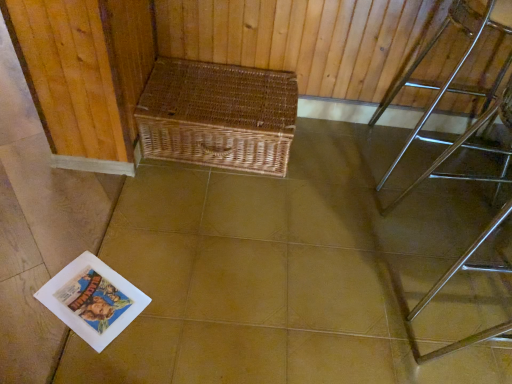
Question: Would you say woven brown picnic basket at center is outside polished chrome table at right?

Choices:
 (A) no
 (B) yes

Answer: (B)

Question: Are woven brown picnic basket at center and polished chrome table at right making contact?

Choices:
 (A) yes
 (B) no

Answer: (B)

Question: Is woven brown picnic basket at center shorter than polished chrome table at right?

Choices:
 (A) yes
 (B) no

Answer: (A)

Question: Is woven brown picnic basket at center further to the viewer compared to polished chrome table at right?

Choices:
 (A) yes
 (B) no

Answer: (A)

Question: Does woven brown picnic basket at center have a larger size compared to polished chrome table at right?

Choices:
 (A) no
 (B) yes

Answer: (A)

Question: From the image's perspective, is woven wicker basket at upper center above or below woven brown picnic basket at center?

Choices:
 (A) above
 (B) below

Answer: (B)

Question: Choose the correct answer: Is woven wicker basket at upper center inside woven brown picnic basket at center or outside it?

Choices:
 (A) inside
 (B) outside

Answer: (B)

Question: Does point (352, 307) appear closer or farther from the camera than point (224, 142)?

Choices:
 (A) farther
 (B) closer

Answer: (B)

Question: In terms of width, does woven wicker basket at upper center look wider or thinner when compared to woven brown picnic basket at center?

Choices:
 (A) wide
 (B) thin

Answer: (A)

Question: Considering their positions, is polished chrome table at right located in front of or behind woven wicker basket at upper center?

Choices:
 (A) front
 (B) behind

Answer: (A)

Question: From the image's perspective, is polished chrome table at right positioned above or below woven wicker basket at upper center?

Choices:
 (A) below
 (B) above

Answer: (B)

Question: Is point (488, 11) positioned closer to the camera than point (210, 344)?

Choices:
 (A) farther
 (B) closer

Answer: (A)

Question: Is polished chrome table at right bigger or smaller than woven wicker basket at upper center?

Choices:
 (A) small
 (B) big

Answer: (B)

Question: Is woven brown picnic basket at center inside or outside of polished chrome table at right?

Choices:
 (A) outside
 (B) inside

Answer: (A)

Question: In terms of width, does woven brown picnic basket at center look wider or thinner when compared to polished chrome table at right?

Choices:
 (A) wide
 (B) thin

Answer: (B)